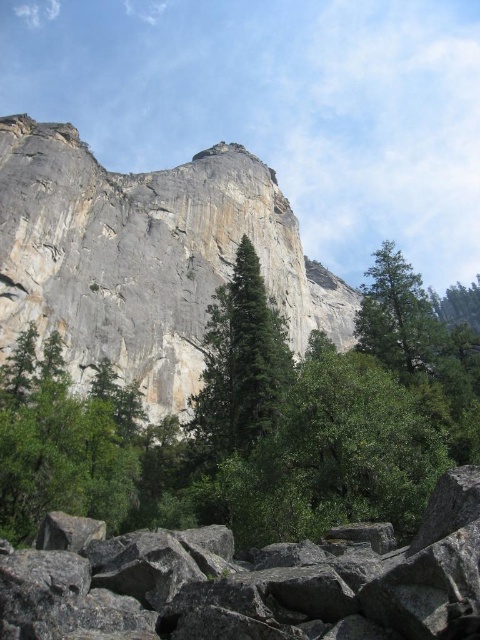
Question: Estimate the real-world distances between objects in this image. Which object is farther from the gray rock formation at upper center?

Choices:
 (A) green matte tree at lower left
 (B) green leafy tree at center
 (C) green matte tree at center
 (D) green textured tree at lower right

Answer: (D)

Question: Can you confirm if gray rock formation at upper center is bigger than gray rough rocks at lower center?

Choices:
 (A) no
 (B) yes

Answer: (B)

Question: Which object is closer to the camera taking this photo?

Choices:
 (A) green leafy tree at center
 (B) green matte tree at center

Answer: (A)

Question: Is green matte tree at center to the right of green textured tree at lower right from the viewer's perspective?

Choices:
 (A) no
 (B) yes

Answer: (A)

Question: Is gray rock formation at upper center above gray rough rocks at lower center?

Choices:
 (A) yes
 (B) no

Answer: (A)

Question: Which object appears farthest from the camera in this image?

Choices:
 (A) green textured tree at lower right
 (B) green leafy tree at center
 (C) gray rough rocks at lower center
 (D) green matte tree at center

Answer: (A)